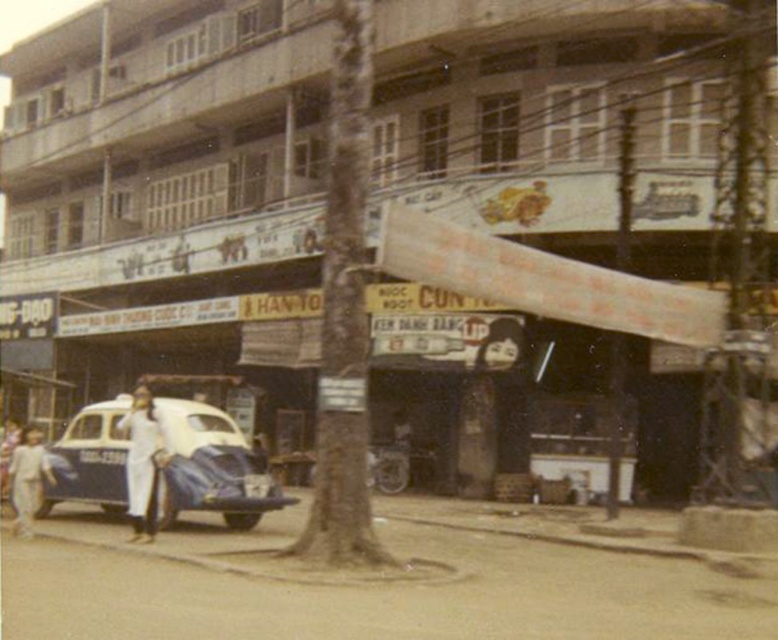
Which is above, blue metallic taxi at lower left or light beige pants at lower left?

Positioned higher is light beige pants at lower left.

Between point (107, 499) and point (44, 465), which one is positioned behind?

Point (107, 499)

Is point (205, 470) farther from camera compared to point (23, 440)?

No, (205, 470) is closer to viewer.

The height and width of the screenshot is (640, 778). I want to click on blue metallic taxi at lower left, so click(212, 467).

Does white clothed person at center have a lesser height compared to white clothed person at lower left?

No, white clothed person at center is not shorter than white clothed person at lower left.

Can you confirm if white clothed person at center is positioned below white clothed person at lower left?

Incorrect, white clothed person at center is not positioned below white clothed person at lower left.

Who is more forward, (125, 480) or (2, 488)?

Positioned in front is point (125, 480).

Where is `white clothed person at center`? Image resolution: width=778 pixels, height=640 pixels. white clothed person at center is located at coordinates (142, 465).

Is blue metallic taxi at lower left behind dark hair at center?

No, blue metallic taxi at lower left is in front of dark hair at center.

In the scene shown: Is blue metallic taxi at lower left smaller than dark hair at center?

No, blue metallic taxi at lower left is not smaller than dark hair at center.

Does point (86, 445) lie in front of point (489, 352)?

That is True.

Where is `blue metallic taxi at lower left`? Image resolution: width=778 pixels, height=640 pixels. blue metallic taxi at lower left is located at coordinates (212, 467).